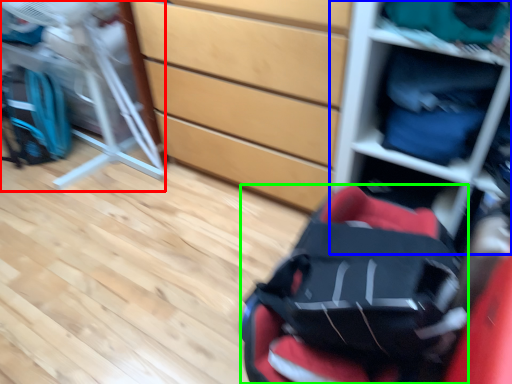
Question: Which object is the farthest from folding chair (highlighted by a red box)? Choose among these: shelf (highlighted by a blue box) or baby carriage (highlighted by a green box).

Choices:
 (A) shelf
 (B) baby carriage

Answer: (B)